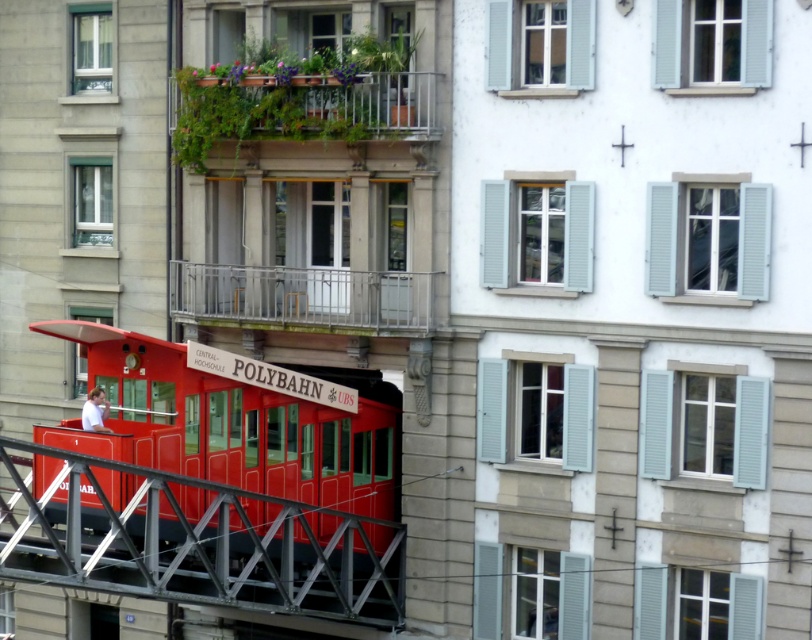
Who is lower down, metallic red polybahn car at lower left or silver metallic railing at center?

metallic red polybahn car at lower left is lower down.

From the picture: Is metallic red polybahn car at lower left taller than silver metallic railing at center?

Yes, metallic red polybahn car at lower left is taller than silver metallic railing at center.

Is point (205, 486) in front of point (214, 310)?

Yes, it is in front of point (214, 310).

You are a GUI agent. You are given a task and a screenshot of the screen. Output one action in this format:
    pyautogui.click(x=<x>, y=<y>)
    Task: Click on the metallic red polybahn car at lower left
    
    Given the screenshot: What is the action you would take?
    pyautogui.click(x=214, y=486)